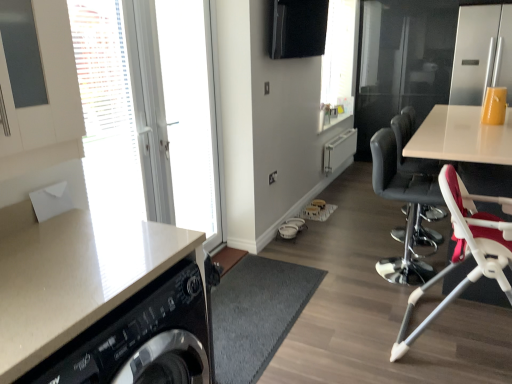
The height and width of the screenshot is (384, 512). Identify the location of free spot to the left of black leather bar stool at right. (362, 232).